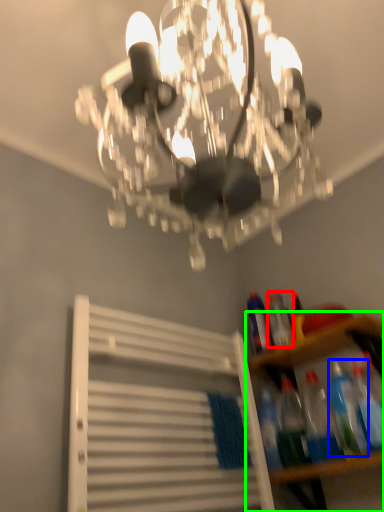
Question: Estimate the real-world distances between objects in this image. Which object is farther from bottle (highlighted by a red box), bottle (highlighted by a blue box) or shelf (highlighted by a green box)?

Choices:
 (A) bottle
 (B) shelf

Answer: (A)